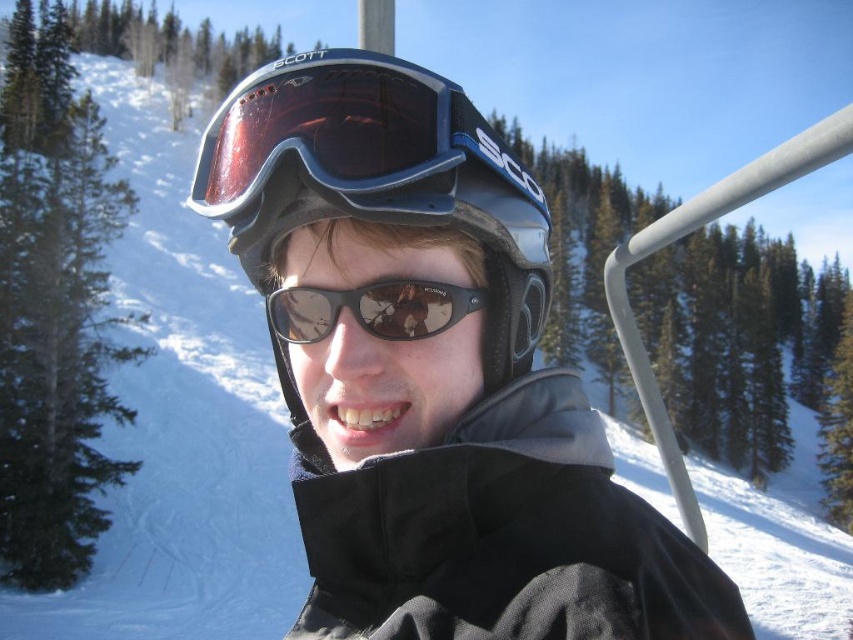
Is matte blue goggles at center positioned before black reflective sunglasses at center?

Yes.

Is matte blue goggles at center smaller than black reflective sunglasses at center?

No, matte blue goggles at center is not smaller than black reflective sunglasses at center.

Where is `matte blue goggles at center`? matte blue goggles at center is located at coordinates coord(329,136).

Is matte black helmet at center smaller than black reflective sunglasses at center?

No, matte black helmet at center is not smaller than black reflective sunglasses at center.

Describe the element at coordinates (376, 177) in the screenshot. I see `matte black helmet at center` at that location.

Is point (299, 224) less distant than point (421, 305)?

Yes, it is.

At what (x,y) coordinates should I click in order to perform the action: click on matte black helmet at center. Please return your answer as a coordinate pair (x, y). The width and height of the screenshot is (853, 640). Looking at the image, I should click on (376, 177).

Is the position of matte black helmet at center more distant than that of matte blue goggles at center?

Yes.

Between matte black helmet at center and matte blue goggles at center, which one is positioned higher?

matte blue goggles at center is above.

Is point (490, 380) farther from viewer compared to point (366, 161)?

Yes, it is behind point (366, 161).

Find the location of a particular element. The image size is (853, 640). matte black helmet at center is located at coordinates (376, 177).